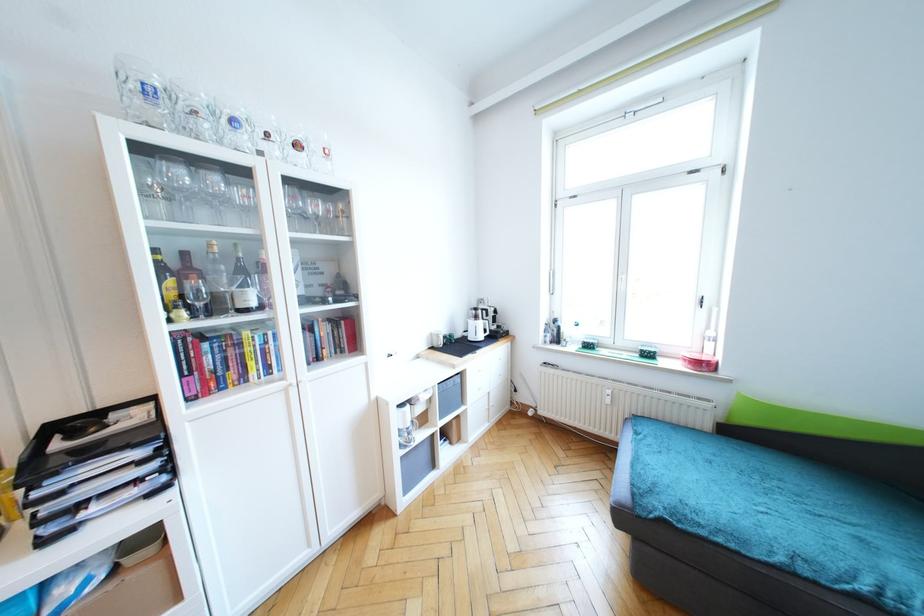
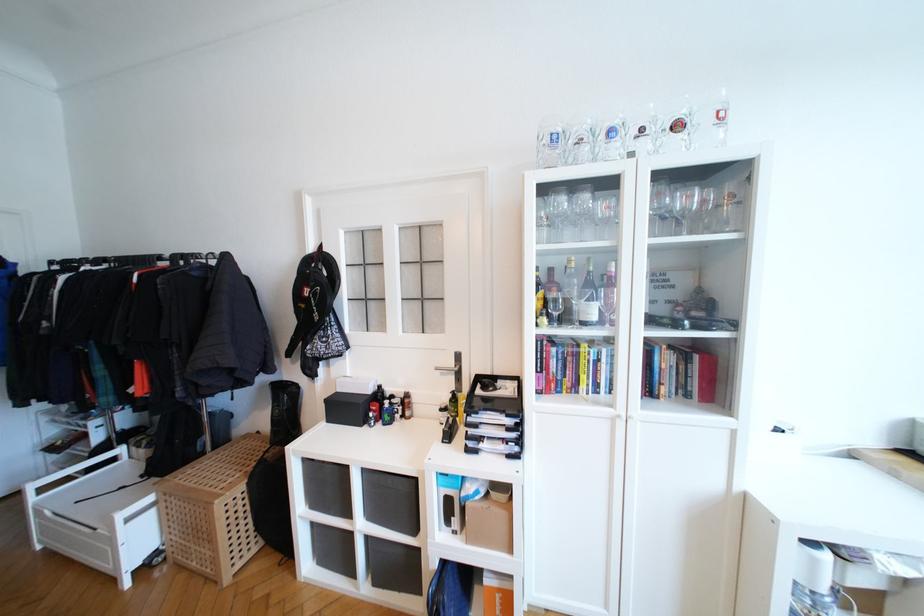
Question: The camera is either moving clockwise (left) or counter-clockwise (right) around the object. The first image is from the beginning of the video and the second image is from the end. Is the camera moving left or right when shooting the video?

Choices:
 (A) Left
 (B) Right

Answer: (B)